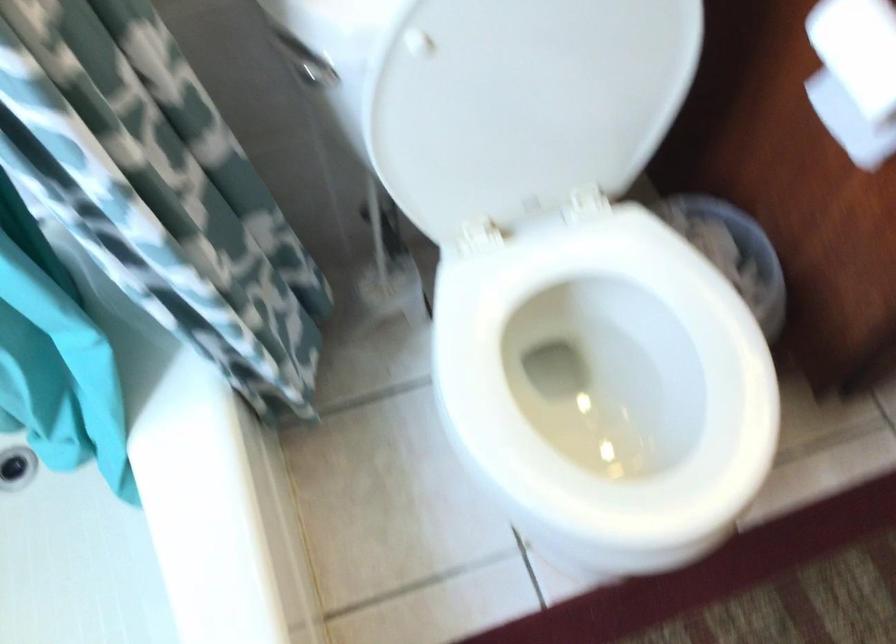
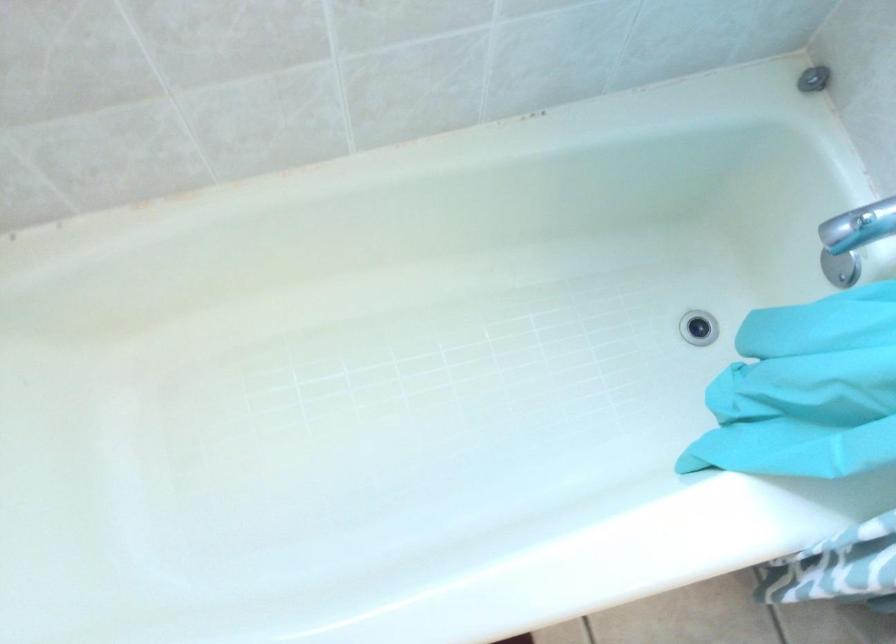
Based on the continuous images, in which direction is the camera rotating?

The rotation direction of the camera is left-down.